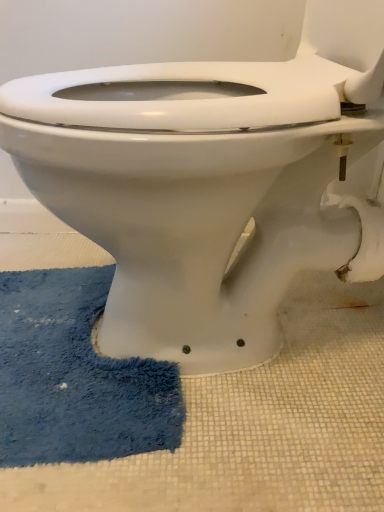
The width and height of the screenshot is (384, 512). What do you see at coordinates (75, 376) in the screenshot? I see `blue plush bath mat at lower left` at bounding box center [75, 376].

Locate an element on the screen. blue plush bath mat at lower left is located at coordinates (75, 376).

Locate an element on the screen. The width and height of the screenshot is (384, 512). white glossy toilet at center is located at coordinates (201, 192).

Image resolution: width=384 pixels, height=512 pixels. Describe the element at coordinates (201, 192) in the screenshot. I see `white glossy toilet at center` at that location.

Find the location of `blue plush bath mat at lower left`. blue plush bath mat at lower left is located at coordinates (75, 376).

Looking at this image, which object is positioned more to the left, white glossy toilet at center or blue plush bath mat at lower left?

blue plush bath mat at lower left.

Considering the positions of objects white glossy toilet at center and blue plush bath mat at lower left in the image provided, who is behind, white glossy toilet at center or blue plush bath mat at lower left?

blue plush bath mat at lower left is further from the camera.

Considering the points (338, 254) and (127, 391), which point is in front, point (338, 254) or point (127, 391)?

The point (338, 254) is more forward.

From the image's perspective, which is above, white glossy toilet at center or blue plush bath mat at lower left?

white glossy toilet at center.

From a real-world perspective, which object stands above the other?

white glossy toilet at center.

Between white glossy toilet at center and blue plush bath mat at lower left, which one has smaller width?

blue plush bath mat at lower left is thinner.

Is white glossy toilet at center shorter than blue plush bath mat at lower left?

Incorrect, the height of white glossy toilet at center does not fall short of that of blue plush bath mat at lower left.

Who is smaller, white glossy toilet at center or blue plush bath mat at lower left?

Smaller between the two is blue plush bath mat at lower left.

Is white glossy toilet at center not within blue plush bath mat at lower left?

Yes, white glossy toilet at center is not within blue plush bath mat at lower left.

Consider the image. Can you see white glossy toilet at center touching blue plush bath mat at lower left?

white glossy toilet at center is not next to blue plush bath mat at lower left, and they're not touching.

Is white glossy toilet at center facing away from blue plush bath mat at lower left?

No, white glossy toilet at center is not facing away from blue plush bath mat at lower left.

What's the angular difference between white glossy toilet at center and blue plush bath mat at lower left's facing directions?

There is a 6.98-degree angle between the facing directions of white glossy toilet at center and blue plush bath mat at lower left.

How much distance is there between white glossy toilet at center and blue plush bath mat at lower left?

The distance of white glossy toilet at center from blue plush bath mat at lower left is 9.34 inches.

Locate an element on the screen. toilet in front of the blue plush bath mat at lower left is located at coordinates (201, 192).

Considering the relative positions of blue plush bath mat at lower left and white glossy toilet at center in the image provided, is blue plush bath mat at lower left to the right of white glossy toilet at center from the viewer's perspective?

In fact, blue plush bath mat at lower left is to the left of white glossy toilet at center.

Between blue plush bath mat at lower left and white glossy toilet at center, which one is positioned in front?

white glossy toilet at center is in front.

Which is behind, point (89, 285) or point (286, 216)?

The point (89, 285) is more distant.

From the image's perspective, is blue plush bath mat at lower left located above or below white glossy toilet at center?

Clearly, from the image's perspective, blue plush bath mat at lower left is below white glossy toilet at center.

From a real-world perspective, is blue plush bath mat at lower left under white glossy toilet at center?

Correct, in the physical world, blue plush bath mat at lower left is lower than white glossy toilet at center.

Which of these two, blue plush bath mat at lower left or white glossy toilet at center, is thinner?

blue plush bath mat at lower left is thinner.

Looking at this image, does blue plush bath mat at lower left have a greater height compared to white glossy toilet at center?

No.

Looking at the image, does blue plush bath mat at lower left seem bigger or smaller compared to white glossy toilet at center?

Clearly, blue plush bath mat at lower left is smaller in size than white glossy toilet at center.

Is blue plush bath mat at lower left completely or partially outside of white glossy toilet at center?

blue plush bath mat at lower left lies outside white glossy toilet at center's area.

Is the surface of blue plush bath mat at lower left in direct contact with white glossy toilet at center?

No, blue plush bath mat at lower left is not in contact with white glossy toilet at center.

Is blue plush bath mat at lower left facing away from white glossy toilet at center?

No, blue plush bath mat at lower left's orientation is not away from white glossy toilet at center.

How much distance is there between blue plush bath mat at lower left and white glossy toilet at center?

blue plush bath mat at lower left and white glossy toilet at center are 9.34 inches apart.

Identify the location of bath mat below the white glossy toilet at center (from the image's perspective). (75, 376).

I want to click on bath mat that appears below the white glossy toilet at center (from a real-world perspective), so click(75, 376).

Locate an element on the screen. toilet lying in front of the blue plush bath mat at lower left is located at coordinates (201, 192).